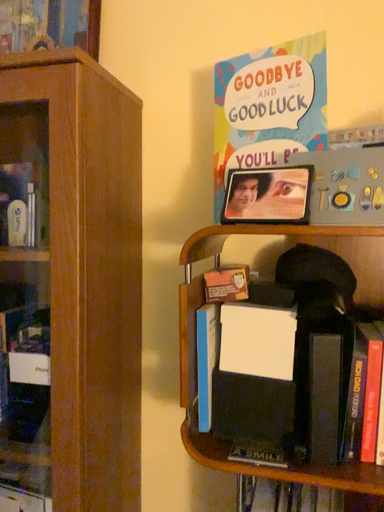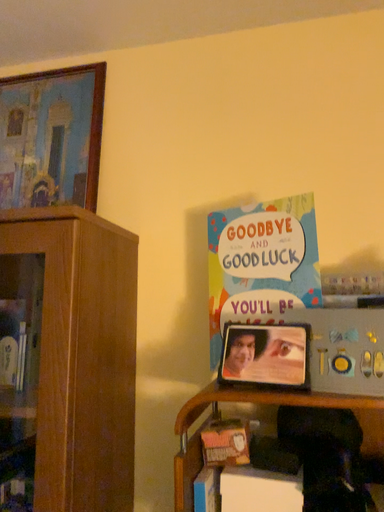
Question: Which way did the camera rotate in the video?

Choices:
 (A) rotated downward
 (B) rotated upward

Answer: (B)